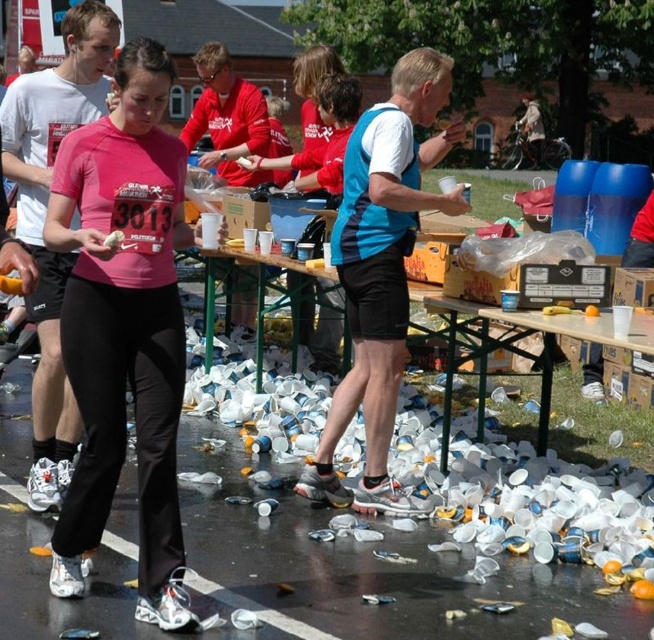
In the scene shown: Is pink matte shirt at center thinner than white plastic table at center?

Yes.

The image size is (654, 640). What are the coordinates of `pink matte shirt at center` in the screenshot? It's located at pyautogui.click(x=124, y=328).

Does white plastic table at center lie in front of white plastic cup at center?

No, it is not.

Locate an element on the screen. The image size is (654, 640). white plastic table at center is located at coordinates (281, 307).

Locate an element on the screen. white plastic table at center is located at coordinates (281, 307).

The height and width of the screenshot is (640, 654). What do you see at coordinates (124, 328) in the screenshot? I see `pink matte shirt at center` at bounding box center [124, 328].

Does pink matte shirt at center have a lesser height compared to white plastic cups at center?

No.

Which is in front, point (107, 145) or point (538, 314)?

Point (107, 145) is in front.

In order to click on pink matte shirt at center in this screenshot , I will do `click(124, 328)`.